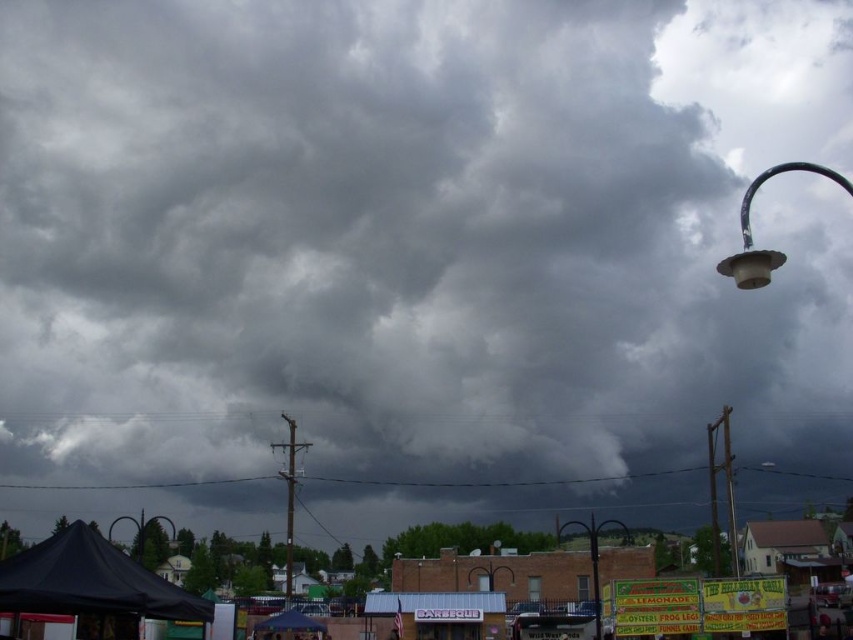
Is metallic pole at right shorter than matte black street light at lower left?

Yes.

Who is lower down, metallic pole at right or matte black street light at lower left?

matte black street light at lower left is below.

At what (x,y) coordinates should I click in order to perform the action: click on metallic pole at right. Please return your answer as a coordinate pair (x, y). The image size is (853, 640). Looking at the image, I should click on (730, 515).

This screenshot has height=640, width=853. I want to click on metallic pole at right, so click(730, 515).

Is matte plastic street light at upper right to the left of matte black street light at lower left from the viewer's perspective?

No, matte plastic street light at upper right is not to the left of matte black street light at lower left.

Which of these two, matte plastic street light at upper right or matte black street light at lower left, stands taller?

matte plastic street light at upper right is taller.

Is point (746, 218) behind point (173, 536)?

Yes.

The height and width of the screenshot is (640, 853). I want to click on matte plastic street light at upper right, so click(750, 230).

Does metallic streetlight at center have a larger size compared to metallic pole at right?

No, metallic streetlight at center is not bigger than metallic pole at right.

In the scene shown: Who is lower down, metallic streetlight at center or metallic pole at right?

metallic streetlight at center

Is point (596, 548) behind point (728, 513)?

That is False.

You are a GUI agent. You are given a task and a screenshot of the screen. Output one action in this format:
    pyautogui.click(x=<x>, y=<y>)
    Task: Click on the metallic streetlight at center
    
    Given the screenshot: What is the action you would take?
    pyautogui.click(x=595, y=554)